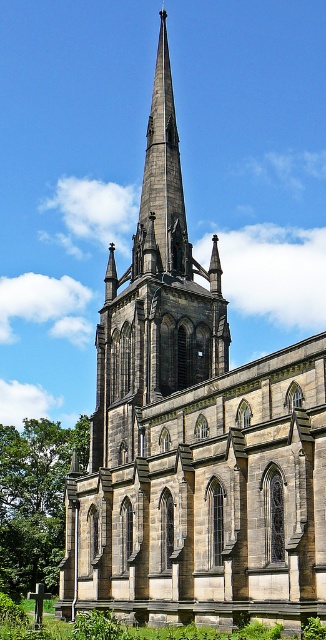
You are standing in front of the Gothic church and notice two points marked on the spire. The first point is at coordinates point (41, 481) and the second at point (173, 93). Which of these points is closer to your current position?

Point (41, 481) is closer to the camera than point (173, 93), so the first point is closer to your current position.

You are standing in front of the Gothic church and want to take a photo of the dark gray stone spire at center. However, there is a green leafy tree at left blocking your view. Can you move to the right side of the tree to get an unobstructed view of the spire?

The green leafy tree at left is further to the viewer than the dark gray stone spire at center, so moving to the right side of the tree would allow you to see around it and get an unobstructed view of the spire.